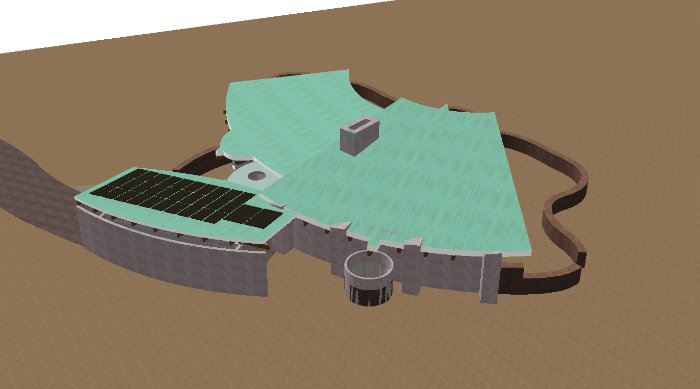
Where is `front wall`? front wall is located at coordinates (410, 272), (489, 274), (323, 249), (295, 232).